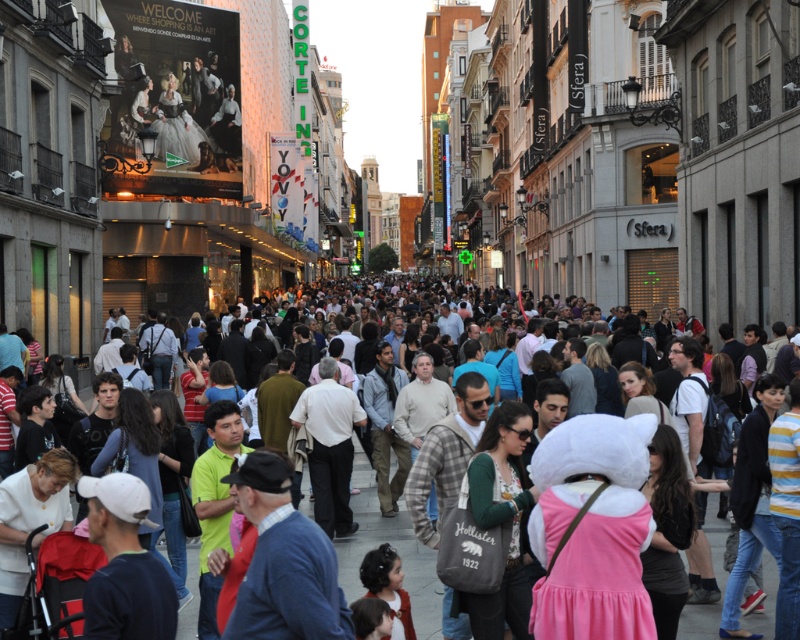
You are standing at the point with coordinates point (96, 468) and want to move forward to a position where you can see the billboard advertising Corte Ingl s. Can you reach that position without moving past the point (14, 474)?

Point (14, 474) is behind point (96, 468), so moving forward from point (96, 468) would take you away from point (14, 474). Therefore, you cannot reach the desired position without moving past point (14, 474).

You are standing at the point labeled point (766, 404) in the image and want to walk to the point labeled point (362, 468). Which direction should you move relative to the image?

You should move upward in the image because point (362, 468) is located above point (766, 404).

What is the exact location of the striped knit sweater at lower right in the image?

The striped knit sweater at lower right is located at point (x=752, y=502).